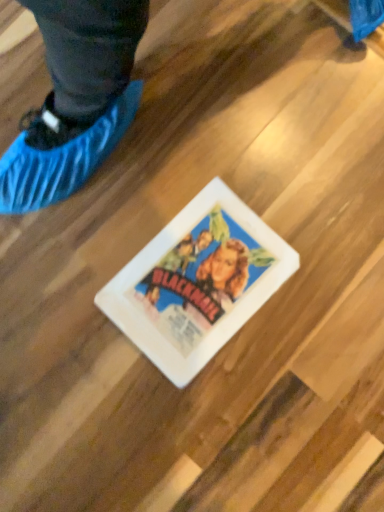
The image size is (384, 512). I want to click on vacant region to the right of white glossy book cover at center, so click(x=325, y=271).